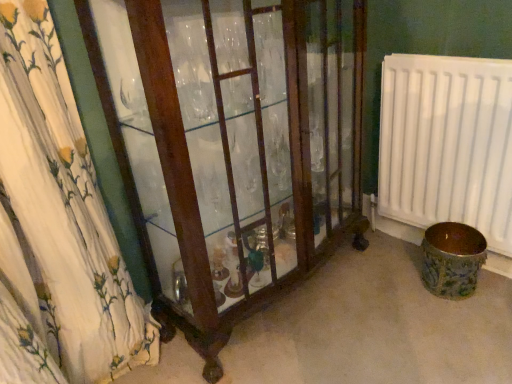
Question: From a real-world perspective, does brown ceramic vase at lower right stand above white plastic radiator at right?

Choices:
 (A) no
 (B) yes

Answer: (A)

Question: Is brown ceramic vase at lower right oriented away from white plastic radiator at right?

Choices:
 (A) yes
 (B) no

Answer: (A)

Question: Does brown ceramic vase at lower right contain white plastic radiator at right?

Choices:
 (A) no
 (B) yes

Answer: (A)

Question: Can you confirm if brown ceramic vase at lower right is taller than white plastic radiator at right?

Choices:
 (A) no
 (B) yes

Answer: (A)

Question: Considering the relative positions of brown ceramic vase at lower right and white plastic radiator at right in the image provided, is brown ceramic vase at lower right to the right of white plastic radiator at right from the viewer's perspective?

Choices:
 (A) no
 (B) yes

Answer: (B)

Question: Is brown ceramic vase at lower right smaller than white plastic radiator at right?

Choices:
 (A) yes
 (B) no

Answer: (A)

Question: Can you see mahogany glass cabinet at left touching white plastic radiator at right?

Choices:
 (A) no
 (B) yes

Answer: (A)

Question: From the image's perspective, is mahogany glass cabinet at left on top of white plastic radiator at right?

Choices:
 (A) no
 (B) yes

Answer: (A)

Question: Is mahogany glass cabinet at left far from white plastic radiator at right?

Choices:
 (A) no
 (B) yes

Answer: (A)

Question: Can you confirm if mahogany glass cabinet at left is smaller than white plastic radiator at right?

Choices:
 (A) no
 (B) yes

Answer: (A)

Question: Is mahogany glass cabinet at left looking in the opposite direction of white plastic radiator at right?

Choices:
 (A) yes
 (B) no

Answer: (B)

Question: Is mahogany glass cabinet at left shorter than white plastic radiator at right?

Choices:
 (A) yes
 (B) no

Answer: (B)

Question: Does brown ceramic vase at lower right turn towards mahogany glass cabinet at left?

Choices:
 (A) no
 (B) yes

Answer: (A)